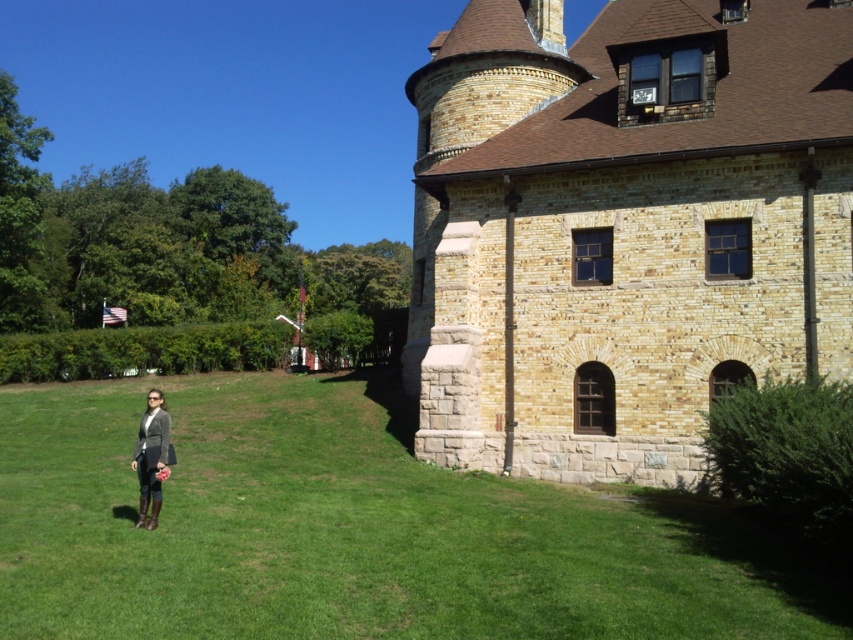
You are a photographer trying to capture the building and the person in the scene. Since both the green grass at lower left and the matte gray blazer at lower left are in your view, which one should you focus on first to ensure they are both in sharp focus?

The green grass at lower left is closer to the viewer than the matte gray blazer at lower left. To ensure both are in sharp focus, focus on the green grass at lower left first, as it is closer, and the depth of field may naturally include the matte gray blazer at lower left in the background.